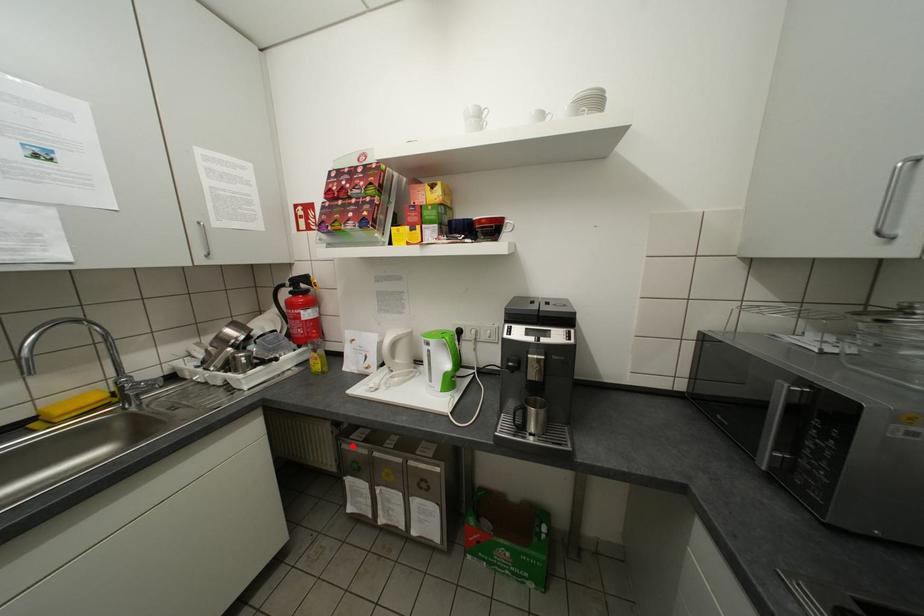
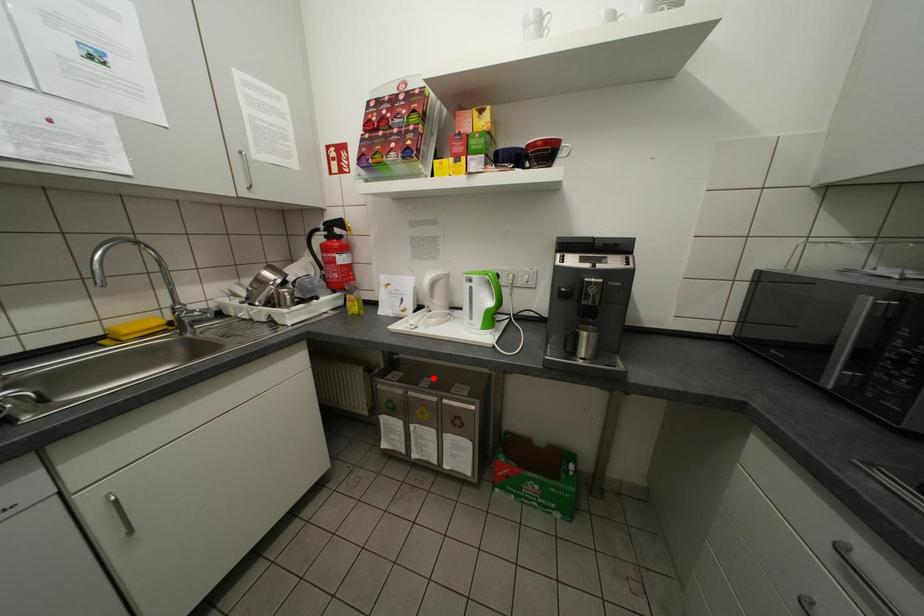
I am providing you with two images of the same scene from different viewpoints. A red point is marked on the first image and another point is marked on the second image. Are the points marked in image1 and image2 representing the same 3D position?

No